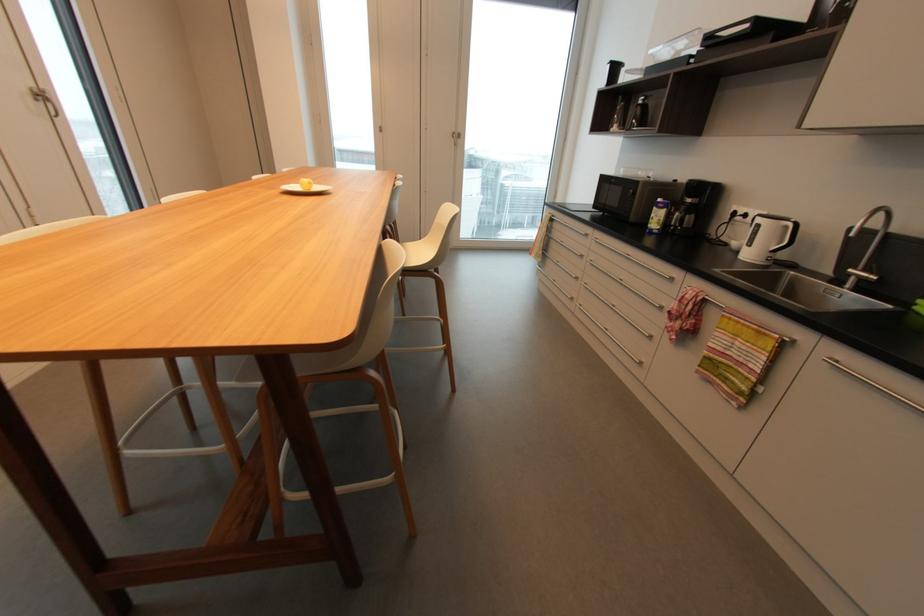
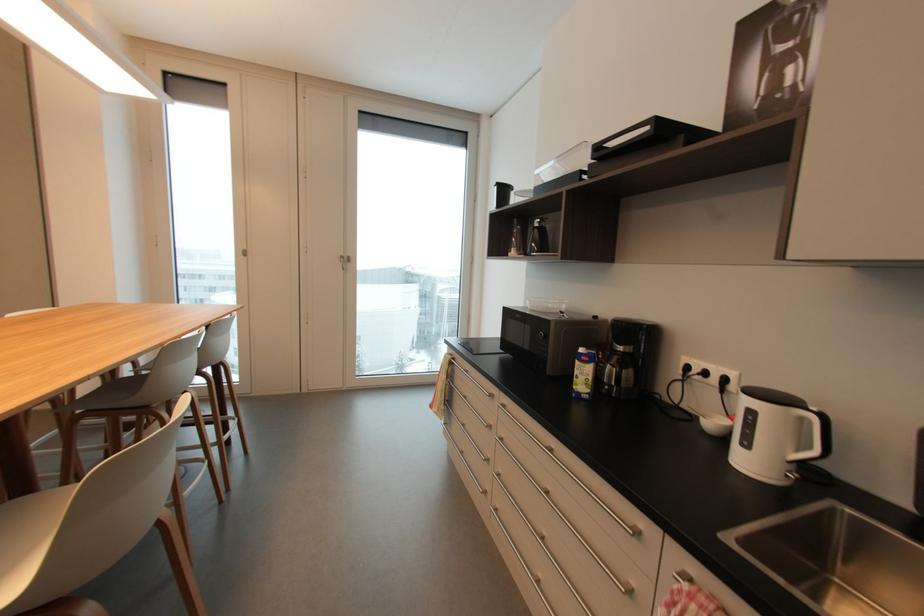
Which direction would the cameraman need to move to produce the second image?

The cameraman moved toward right, forward.